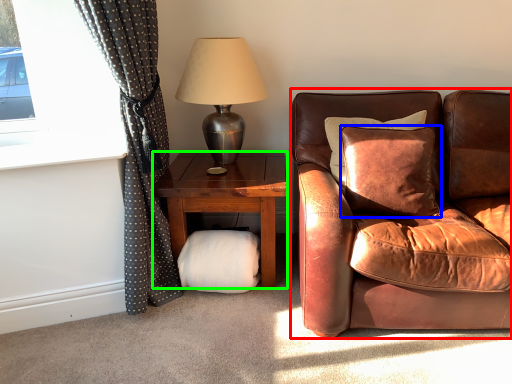
Question: Based on their relative distances, which object is farther from chair (highlighted by a red box)? Choose from pillow (highlighted by a blue box) and studio couch (highlighted by a green box).

Choices:
 (A) pillow
 (B) studio couch

Answer: (B)